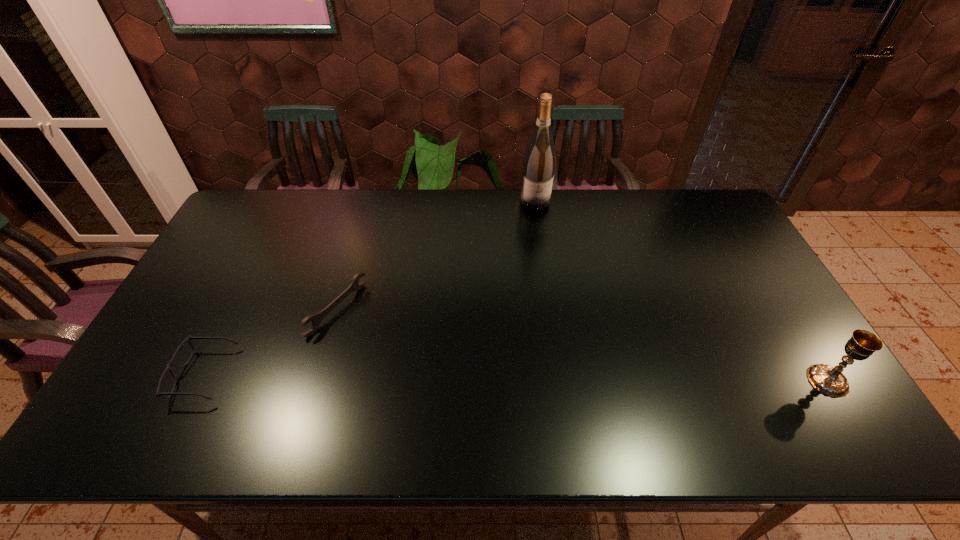
Identify the location of empty location between the tallest object and the wrench. The height and width of the screenshot is (540, 960). (436, 255).

This screenshot has height=540, width=960. Find the location of `unoccupied area between the spectacles and the wrench`. unoccupied area between the spectacles and the wrench is located at coordinates (270, 342).

Locate an element on the screen. This screenshot has width=960, height=540. vacant space that's between the chalice and the spectacles is located at coordinates (516, 377).

I want to click on free space between the second object from right to left and the third shortest object, so click(x=682, y=291).

This screenshot has height=540, width=960. Find the location of `vacant area that lies between the wrench and the second tallest object`. vacant area that lies between the wrench and the second tallest object is located at coordinates (583, 345).

The height and width of the screenshot is (540, 960). What are the coordinates of `vacant space in between the tallest object and the leftmost object` in the screenshot? It's located at (369, 288).

This screenshot has width=960, height=540. In order to click on vacant area that lies between the spectacles and the chalice in this screenshot , I will do `click(516, 377)`.

Locate an element on the screen. object that can be found as the second closest to the second farthest object is located at coordinates (538, 168).

The width and height of the screenshot is (960, 540). What are the coordinates of `object that is the third closest one to the third shortest object` in the screenshot? It's located at (158, 393).

Locate an element on the screen. vacant area in the image that satisfies the following two spatial constraints: 1. on the front side of the rightmost object; 2. on the left side of the wrench is located at coordinates (317, 381).